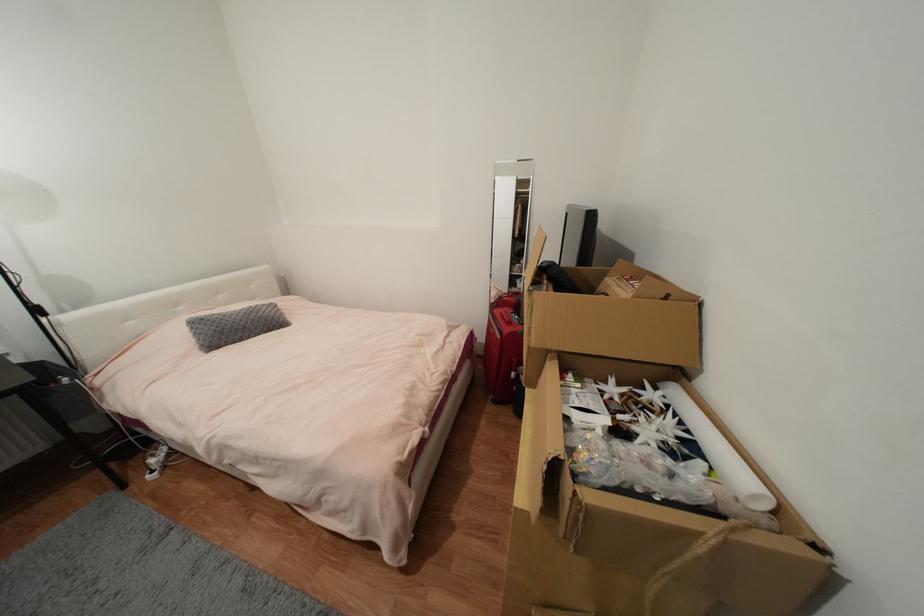
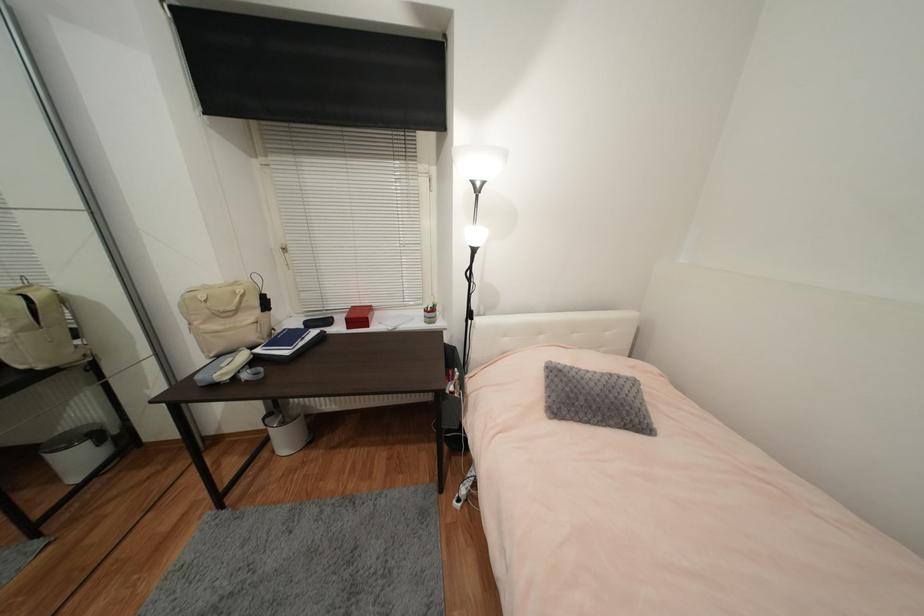
Locate, in the second image, the point that corresponds to point (51, 315) in the first image.

(477, 320)